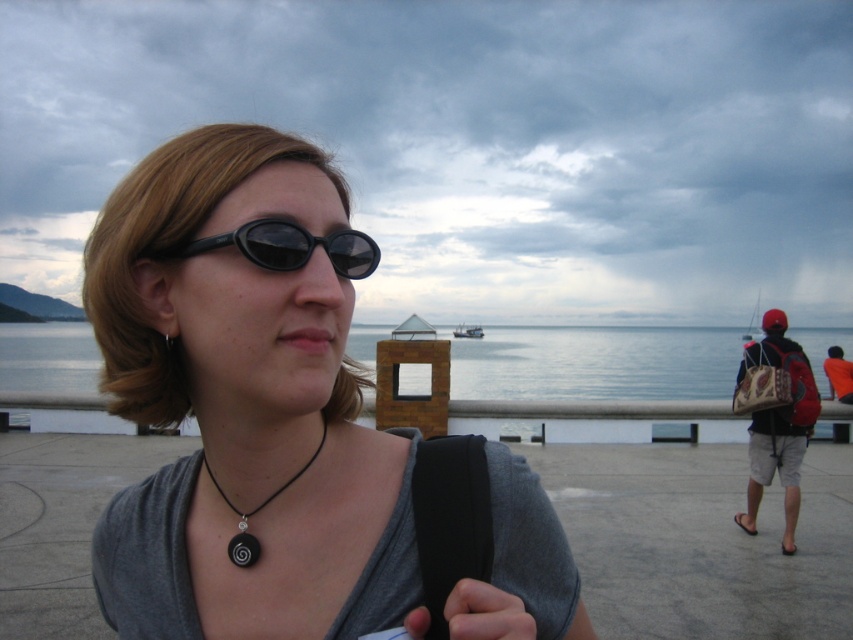
Question: Is leather backpack at right above black matte sunglasses at center?

Choices:
 (A) yes
 (B) no

Answer: (B)

Question: Does leather backpack at right have a lesser width compared to black matte pendant at center?

Choices:
 (A) yes
 (B) no

Answer: (B)

Question: Where is leather backpack at right located in relation to black matte sunglasses at center in the image?

Choices:
 (A) left
 (B) right

Answer: (B)

Question: Which object is farther from the camera taking this photo?

Choices:
 (A) transparent water at center
 (B) black matte sunglasses at center

Answer: (A)

Question: Among these objects, which one is farthest from the camera?

Choices:
 (A) black matte pendant at center
 (B) black matte sunglasses at center
 (C) matte gray shirt at center

Answer: (A)

Question: Which object appears farthest from the camera in this image?

Choices:
 (A) black matte sunglasses at center
 (B) black matte pendant at center
 (C) leather backpack at right
 (D) transparent water at center

Answer: (D)